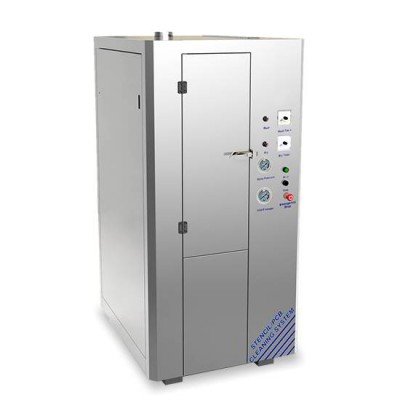
Identify the location of handles. This screenshot has width=400, height=400. (241, 151), (140, 100).